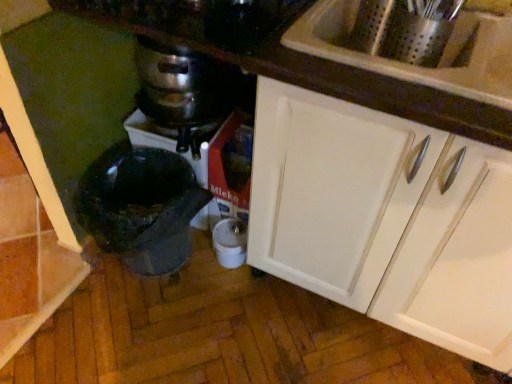
What are the coordinates of `vacant area that lies to the right of black matte mortar at lower left, placed as the 1th appliance when sorted from left to right` in the screenshot? It's located at (233, 296).